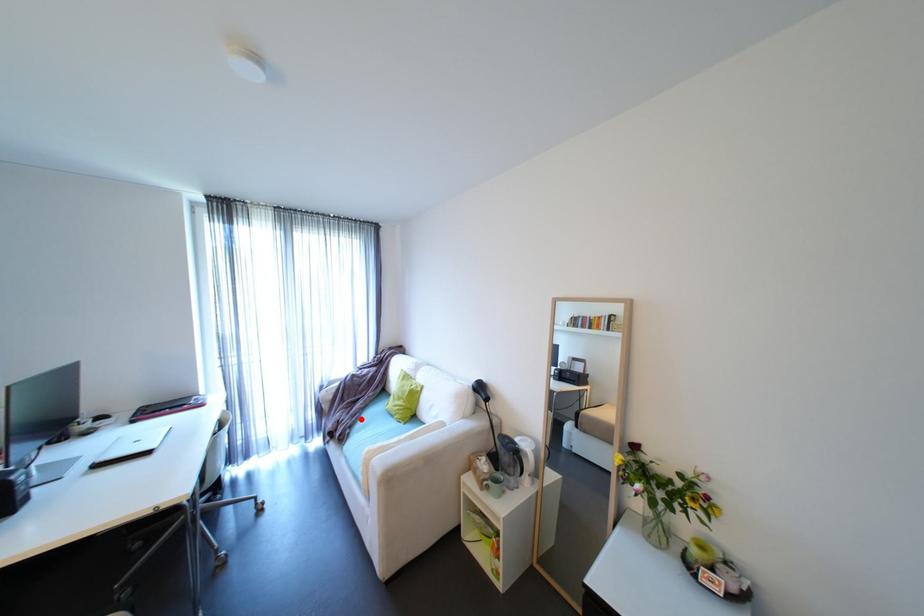
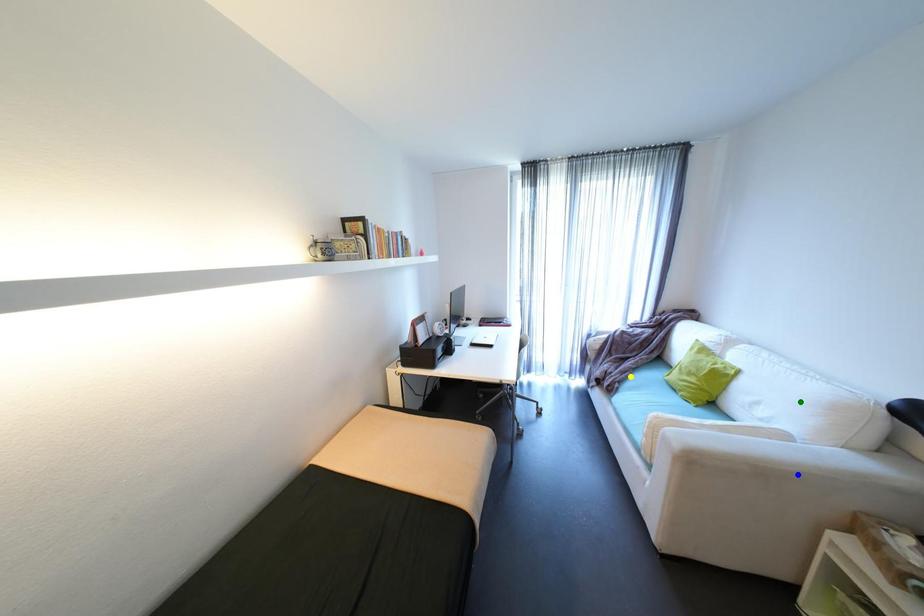
Question: I am providing you with two images of the same scene from different viewpoints. A red point is marked on the first image. You are given multiple points on the second image. Can you choose the point in image 2 that corresponds to the point in image 1?

Choices:
 (A) blue point
 (B) yellow point
 (C) green point

Answer: (B)